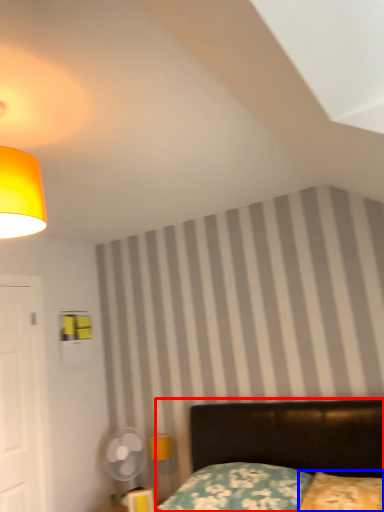
Question: Which point is further to the camera, bed (highlighted by a red box) or pillow (highlighted by a blue box)?

Choices:
 (A) bed
 (B) pillow

Answer: (B)